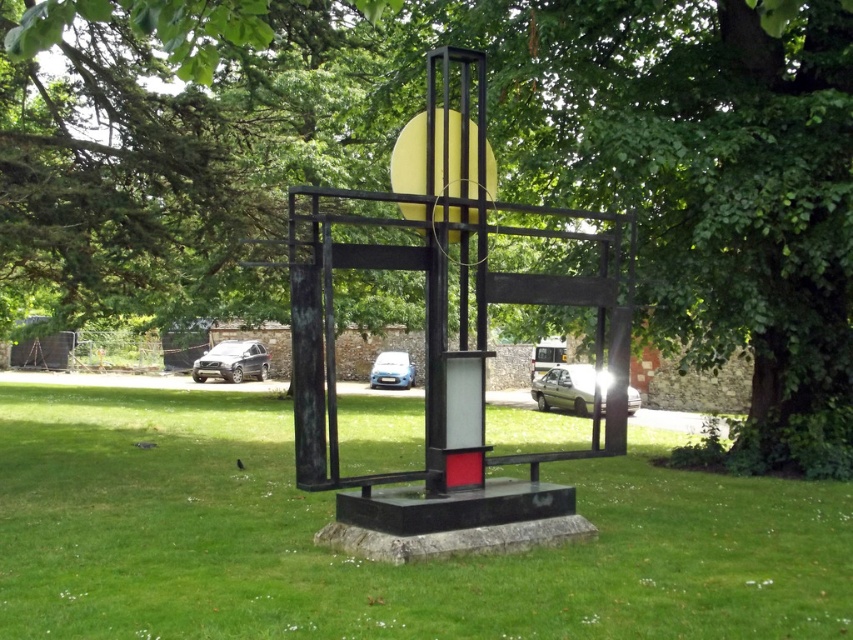
You are standing in the outdoor area and want to take a photo of the green leafy tree at center and the green grass at center. Which object is positioned to the left when facing the sculpture?

The green leafy tree at center is to the left of the green grass at center when facing the sculpture.

You are standing in front of the sculpture and want to take a photo of the green leafy tree at center and the green grass at center. Which object will appear closer to the camera in the photo?

The green leafy tree at center will appear closer to the camera in the photo because it is in front of the green grass at center.

You are standing at the base of the sculpture and want to take a photo of the green leafy tree at center. The camera you are using has a zoom lens that can focus on objects within a 0.5 unit radius. Given that the point marking the tree is at coordinate (604,148), will the tree be in focus if you aim your camera at this point?

The point (604,148) marks the green leafy tree at center. Since the camera can focus within a 0.5 unit radius, and the tree is exactly at this point, it will be in focus.